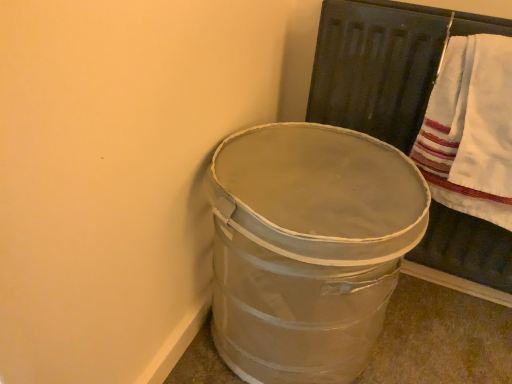
Question: Is metallic silver bucket at lower right aimed at white cotton towel at upper right?

Choices:
 (A) yes
 (B) no

Answer: (B)

Question: From a real-world perspective, is metallic silver bucket at lower right physically above white cotton towel at upper right?

Choices:
 (A) yes
 (B) no

Answer: (B)

Question: Is metallic silver bucket at lower right shorter than white cotton towel at upper right?

Choices:
 (A) yes
 (B) no

Answer: (B)

Question: Can you confirm if metallic silver bucket at lower right is bigger than white cotton towel at upper right?

Choices:
 (A) yes
 (B) no

Answer: (A)

Question: Is metallic silver bucket at lower right oriented away from white cotton towel at upper right?

Choices:
 (A) no
 (B) yes

Answer: (A)

Question: From the image's perspective, does metallic silver bucket at lower right appear lower than white cotton towel at upper right?

Choices:
 (A) no
 (B) yes

Answer: (B)

Question: Can you confirm if white cotton towel at upper right is positioned to the right of metallic silver bucket at lower right?

Choices:
 (A) no
 (B) yes

Answer: (B)

Question: Does white cotton towel at upper right lie in front of metallic silver bucket at lower right?

Choices:
 (A) no
 (B) yes

Answer: (A)

Question: Considering the relative sizes of white cotton towel at upper right and metallic silver bucket at lower right in the image provided, is white cotton towel at upper right smaller than metallic silver bucket at lower right?

Choices:
 (A) no
 (B) yes

Answer: (B)

Question: Is white cotton towel at upper right placed right next to metallic silver bucket at lower right?

Choices:
 (A) yes
 (B) no

Answer: (B)

Question: From the image's perspective, is white cotton towel at upper right above metallic silver bucket at lower right?

Choices:
 (A) no
 (B) yes

Answer: (B)

Question: Is white cotton towel at upper right oriented away from metallic silver bucket at lower right?

Choices:
 (A) yes
 (B) no

Answer: (B)

Question: Is white cotton towel at upper right spatially inside metallic silver bucket at lower right, or outside of it?

Choices:
 (A) inside
 (B) outside

Answer: (B)